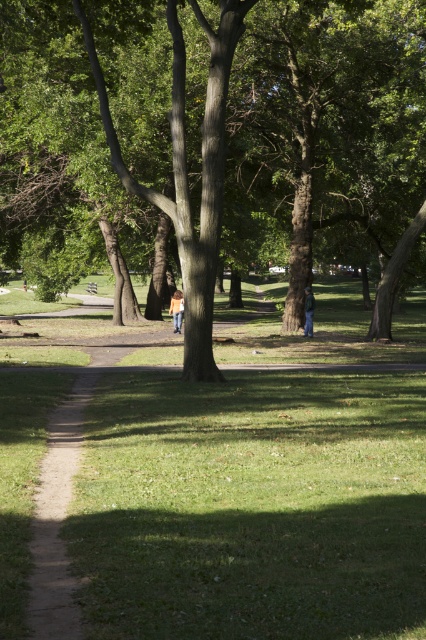
You are standing at the center of the park and see the green leafy tree at center and the orange fabric jacket at center. Which object is positioned to the right side from your perspective?

The green leafy tree at center is to the right of the orange fabric jacket at center, so it is positioned to the right side from your perspective.

You are standing on the dirt path in the park and see a point marked at coordinates (213, 141). Which object in the scene does this point belong to?

The point at coordinates (213, 141) belongs to the green leafy tree at center.